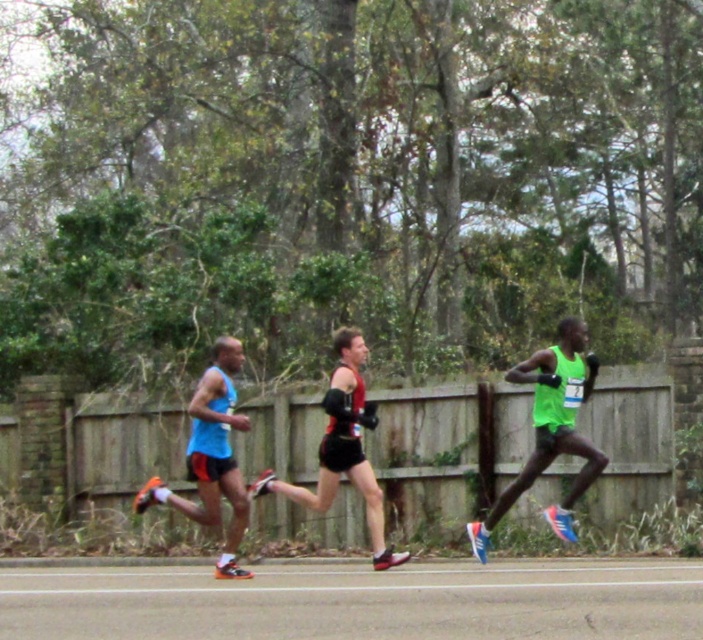
Is point (548, 394) positioned behind point (193, 504)?

No, (548, 394) is in front of (193, 504).

Does neon green fabric at center come behind blue matte shorts at center?

Yes.

Which is behind, point (515, 371) or point (226, 365)?

Point (515, 371)

At what (x,y) coordinates should I click in order to perform the action: click on neon green fabric at center. Please return your answer as a coordinate pair (x, y). Looking at the image, I should click on (550, 428).

Can you confirm if wooden fence at center is wider than reddish-black running suit at center?

Indeed, wooden fence at center has a greater width compared to reddish-black running suit at center.

Between wooden fence at center and reddish-black running suit at center, which one is positioned lower?

Positioned lower is wooden fence at center.

You are a GUI agent. You are given a task and a screenshot of the screen. Output one action in this format:
    pyautogui.click(x=<x>, y=<y>)
    Task: Click on the wooden fence at center
    
    Given the screenshot: What is the action you would take?
    pyautogui.click(x=446, y=448)

Does wooden fence at center have a smaller size compared to neon green fabric at center?

Yes.

Who is shorter, wooden fence at center or neon green fabric at center?

With less height is wooden fence at center.

Find the location of a particular element. The height and width of the screenshot is (640, 703). wooden fence at center is located at coordinates click(446, 448).